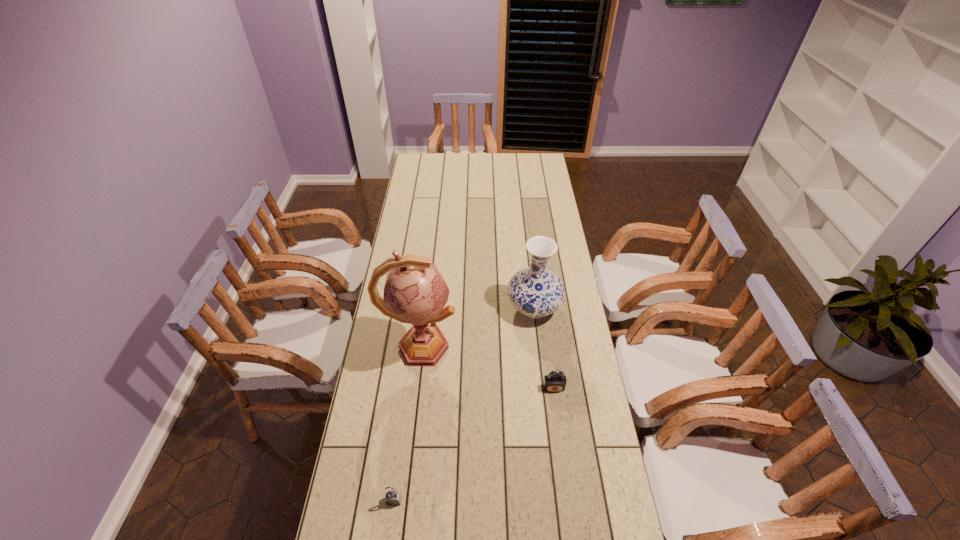
Locate an element on the screen. This screenshot has width=960, height=540. free region that satisfies the following two spatial constraints: 1. on the front side of the vase; 2. on the front-facing side of the tallest object is located at coordinates (538, 347).